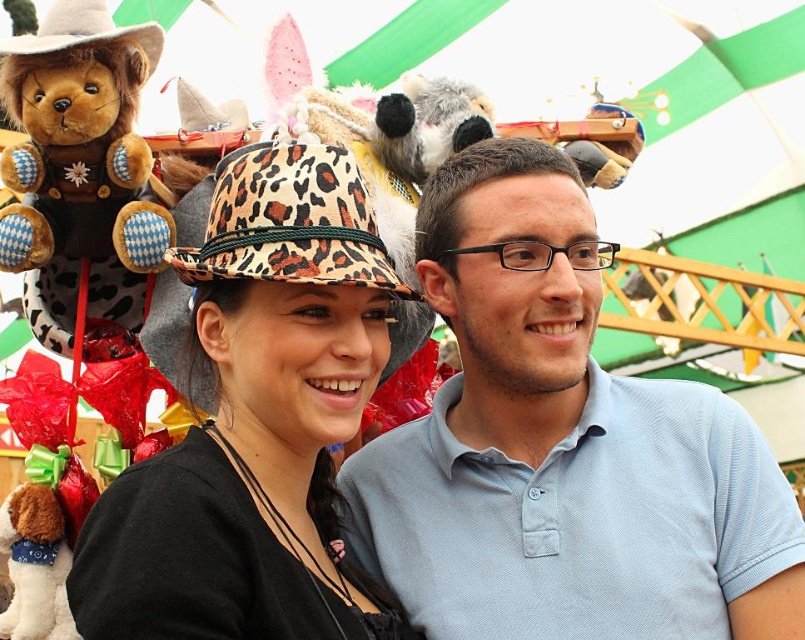
Question: Which point is closer to the camera?

Choices:
 (A) brown plush bear at left
 (B) leopard print hat at center
 (C) light blue cotton shirt at center
 (D) leopard print fabric bucket hat at center

Answer: (B)

Question: Which object appears closest to the camera in this image?

Choices:
 (A) light blue cotton shirt at center
 (B) brown plush bear at left

Answer: (B)

Question: Can you confirm if leopard print hat at center is smaller than brown plush bear at left?

Choices:
 (A) no
 (B) yes

Answer: (A)

Question: Observing the image, what is the correct spatial positioning of light blue cotton shirt at center in reference to leopard print hat at center?

Choices:
 (A) below
 (B) above

Answer: (A)

Question: Which of the following is the closest to the observer?

Choices:
 (A) brown plush bear at left
 (B) leopard print hat at center

Answer: (B)

Question: Does brown plush bear at left have a lesser width compared to leopard print fabric bucket hat at center?

Choices:
 (A) yes
 (B) no

Answer: (A)